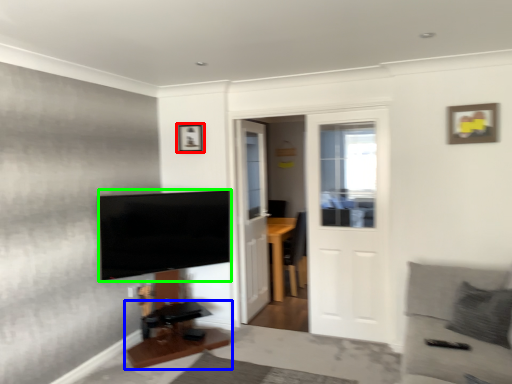
Question: Which is nearer to the picture frame (highlighted by a red box)? table (highlighted by a blue box) or television (highlighted by a green box).

Choices:
 (A) table
 (B) television

Answer: (B)